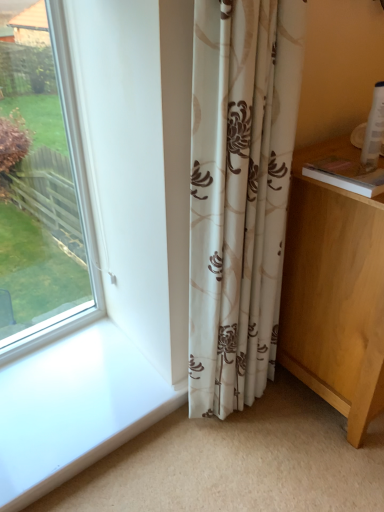
Question: Considering the relative sizes of beige floral curtain at center and light wood vanity at lower right in the image provided, is beige floral curtain at center bigger than light wood vanity at lower right?

Choices:
 (A) no
 (B) yes

Answer: (A)

Question: Is beige floral curtain at center thinner than light wood vanity at lower right?

Choices:
 (A) no
 (B) yes

Answer: (B)

Question: From a real-world perspective, is beige floral curtain at center positioned over light wood vanity at lower right based on gravity?

Choices:
 (A) yes
 (B) no

Answer: (A)

Question: Does beige floral curtain at center appear on the right side of light wood vanity at lower right?

Choices:
 (A) yes
 (B) no

Answer: (B)

Question: Is beige floral curtain at center surrounding light wood vanity at lower right?

Choices:
 (A) no
 (B) yes

Answer: (A)

Question: Considering the relative sizes of beige floral curtain at center and light wood vanity at lower right in the image provided, is beige floral curtain at center wider than light wood vanity at lower right?

Choices:
 (A) no
 (B) yes

Answer: (A)

Question: Does light wood vanity at lower right have a lesser width compared to beige floral curtain at center?

Choices:
 (A) no
 (B) yes

Answer: (A)

Question: Is beige floral curtain at center a part of light wood vanity at lower right?

Choices:
 (A) no
 (B) yes

Answer: (A)

Question: Can you confirm if light wood vanity at lower right is smaller than beige floral curtain at center?

Choices:
 (A) yes
 (B) no

Answer: (B)

Question: Does light wood vanity at lower right have a lesser height compared to beige floral curtain at center?

Choices:
 (A) yes
 (B) no

Answer: (A)

Question: Does light wood vanity at lower right have a greater height compared to beige floral curtain at center?

Choices:
 (A) yes
 (B) no

Answer: (B)

Question: Does light wood vanity at lower right come in front of beige floral curtain at center?

Choices:
 (A) yes
 (B) no

Answer: (B)

Question: In terms of height, does beige floral curtain at center look taller or shorter compared to light wood vanity at lower right?

Choices:
 (A) tall
 (B) short

Answer: (A)